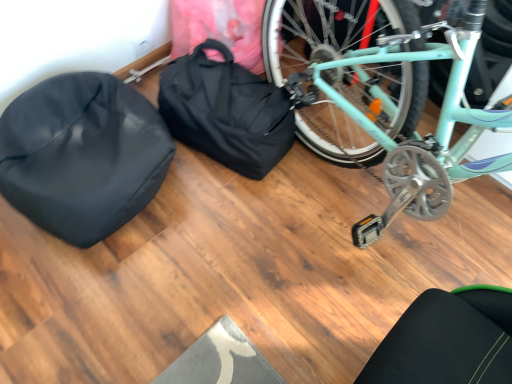
The width and height of the screenshot is (512, 384). I want to click on free location in front of black matte sleeping bag at left, so (104, 302).